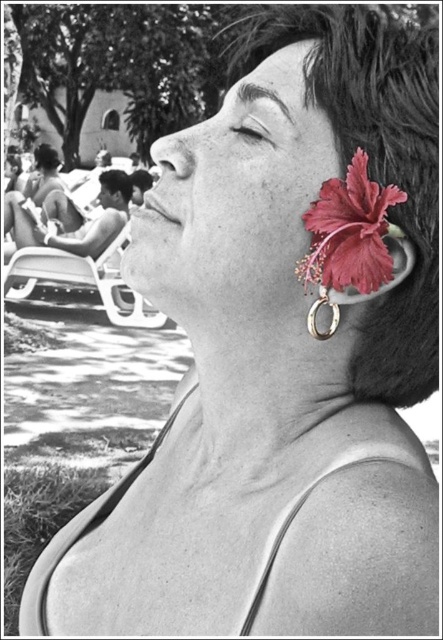
You are a photographer analyzing this image. You need to determine which object is wider between the dark brown hair at upper right and the metallic silver ring at ear. Can you identify which one is wider?

The dark brown hair at upper right is wider than the metallic silver ring at ear according to the description.

You are a photographer adjusting the focus on your camera. You want to ensure that both the metallic silver ring at ear and the lounge chairs in the background are in focus. Given that the depth of field can cover 21.09 inches, will both objects be in focus?

Yes, both the metallic silver ring at ear and the lounge chairs in the background will be in focus since they are 21.09 inches apart, which matches the depth of field coverage.

You are a photographer adjusting the focus of your camera to capture the scene. You notice two points in the image at coordinates point (112, 172) and point (194, 163). Which point should you focus on to ensure the subject in the foreground is sharp?

You should focus on point (194, 163) because it is closer to the viewer than point (112, 172), which is behind it. Since the subject is in the foreground, focusing on the closer point ensures the foreground remains sharp.